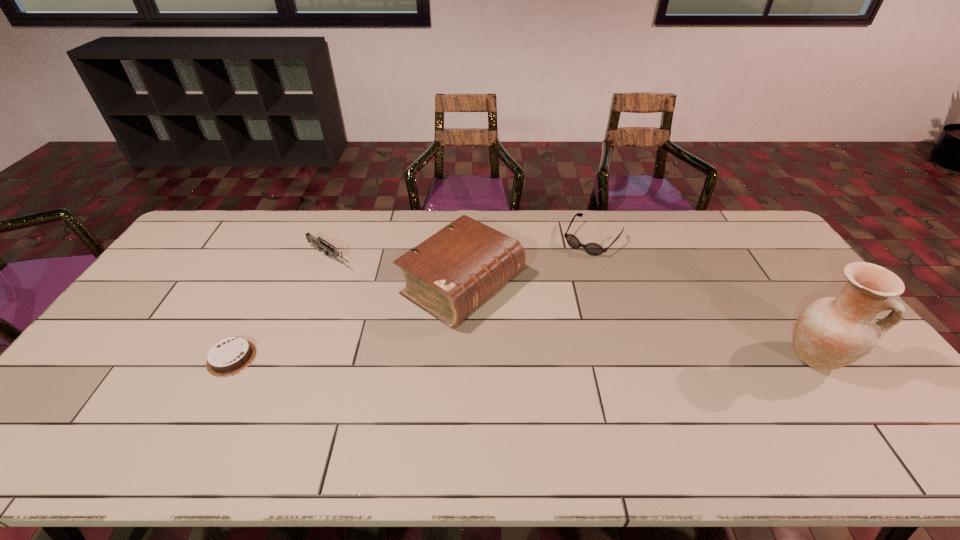
The width and height of the screenshot is (960, 540). What are the coordinates of `vacant spot on the desktop that is between the chocolate cake and the pottery and is positioned on the spine side of the Bible` in the screenshot? It's located at (585, 358).

Identify the location of free space on the desktop that is between the shortest object and the tallest object and is positioned on the lenses of the fourth tallest object. Image resolution: width=960 pixels, height=540 pixels. (495, 358).

This screenshot has width=960, height=540. I want to click on vacant spot on the desktop that is between the leftmost object and the pottery and is positioned aimed along the barrel of the fourth object from right to left, so click(486, 358).